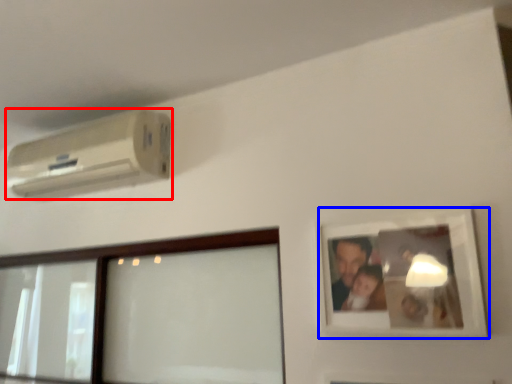
Question: Which point is further to the camera, air conditioning (highlighted by a red box) or picture frame (highlighted by a blue box)?

Choices:
 (A) air conditioning
 (B) picture frame

Answer: (A)